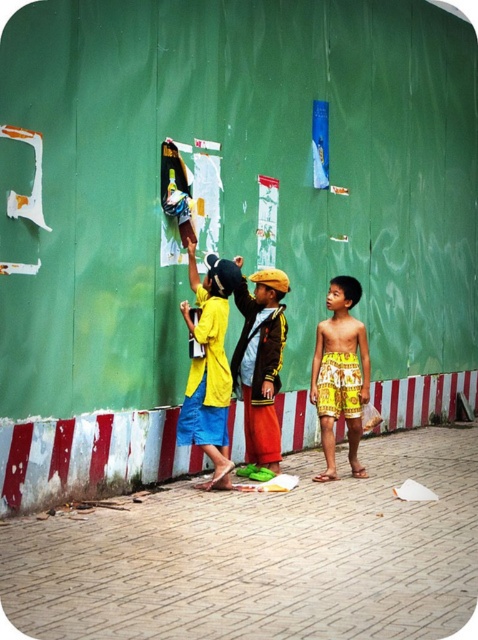
You are a photographer trying to capture the two points in the image. Which point, point 1 at coordinates (212, 444) or point 2 at coordinates (283, 285), appears closer to the camera?

Point 1 at coordinates (212, 444) is closer to the viewer than point 2 at coordinates (283, 285).

You are a tailor measuring two yellow items for a costume design project. You have the yellow fabric jacket at center and the yellow printed shorts at right. Which item requires a wider fabric width for its construction?

The yellow printed shorts at right require a wider fabric width since its width is greater than the yellow fabric jacket at center.